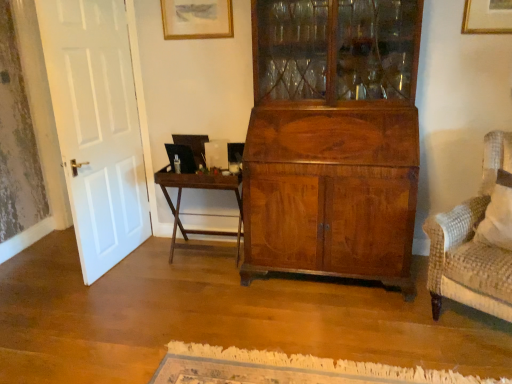
Question: Would you say matte gold picture frame at upper center is outside dark brown wood table at center?

Choices:
 (A) no
 (B) yes

Answer: (B)

Question: Would you say matte gold picture frame at upper center is a long distance from dark brown wood table at center?

Choices:
 (A) no
 (B) yes

Answer: (B)

Question: Is matte gold picture frame at upper center looking in the opposite direction of dark brown wood table at center?

Choices:
 (A) yes
 (B) no

Answer: (B)

Question: Can you confirm if matte gold picture frame at upper center is wider than dark brown wood table at center?

Choices:
 (A) no
 (B) yes

Answer: (A)

Question: Is dark brown wood table at center inside matte gold picture frame at upper center?

Choices:
 (A) no
 (B) yes

Answer: (A)

Question: From the image's perspective, is matte gold picture frame at upper center under dark brown wood table at center?

Choices:
 (A) no
 (B) yes

Answer: (A)

Question: Considering the relative sizes of dark brown wood table at center and matte gold picture frame at upper center in the image provided, is dark brown wood table at center thinner than matte gold picture frame at upper center?

Choices:
 (A) no
 (B) yes

Answer: (A)

Question: Is matte gold picture frame at upper center at the back of dark brown wood table at center?

Choices:
 (A) no
 (B) yes

Answer: (A)

Question: From a real-world perspective, is dark brown wood table at center located higher than matte gold picture frame at upper center?

Choices:
 (A) yes
 (B) no

Answer: (B)

Question: Can you confirm if dark brown wood table at center is positioned to the right of matte gold picture frame at upper center?

Choices:
 (A) no
 (B) yes

Answer: (B)

Question: From the image's perspective, does dark brown wood table at center appear lower than matte gold picture frame at upper center?

Choices:
 (A) yes
 (B) no

Answer: (A)

Question: Is dark brown wood table at center in front of matte gold picture frame at upper center?

Choices:
 (A) no
 (B) yes

Answer: (B)

Question: Does point (228, 185) appear closer or farther from the camera than point (193, 23)?

Choices:
 (A) closer
 (B) farther

Answer: (A)